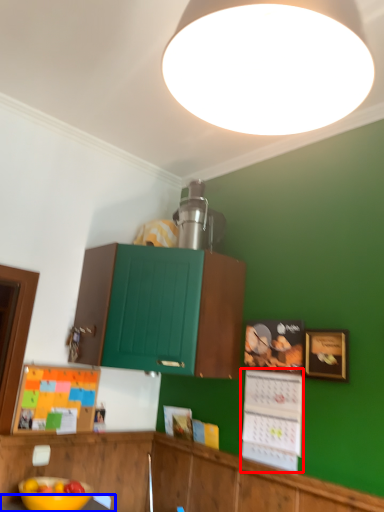
Question: Which point is further to the camera, bulletin board (highlighted by a red box) or table (highlighted by a blue box)?

Choices:
 (A) bulletin board
 (B) table

Answer: (A)